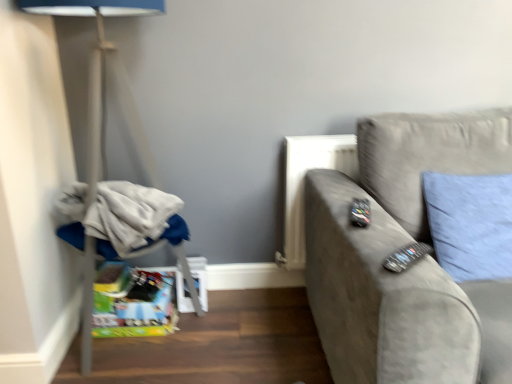
Question: Is black plastic remote at right, which is the 2th remote from bottom to top, beside matte gray lamp at left?

Choices:
 (A) yes
 (B) no

Answer: (B)

Question: Can you confirm if black plastic remote at right, the first remote in the back-to-front sequence, is bigger than matte gray lamp at left?

Choices:
 (A) yes
 (B) no

Answer: (B)

Question: Can you confirm if black plastic remote at right, the first remote in the back-to-front sequence, is smaller than matte gray lamp at left?

Choices:
 (A) no
 (B) yes

Answer: (B)

Question: Considering the relative sizes of black plastic remote at right, the first remote in the back-to-front sequence, and matte gray lamp at left in the image provided, is black plastic remote at right, the first remote in the back-to-front sequence, shorter than matte gray lamp at left?

Choices:
 (A) yes
 (B) no

Answer: (A)

Question: Is black plastic remote at right, acting as the 1th remote starting from the top, positioned far away from matte gray lamp at left?

Choices:
 (A) yes
 (B) no

Answer: (B)

Question: From a real-world perspective, is black plastic remote at right, which is the 2th remote from bottom to top, located higher than matte gray lamp at left?

Choices:
 (A) yes
 (B) no

Answer: (A)

Question: Is black plastic remote at right, acting as the 1th remote starting from the top, at the back of black plastic remote at right, the second remote when ordered from top to bottom?

Choices:
 (A) no
 (B) yes

Answer: (B)

Question: Does black plastic remote at right, which is the 2th remote from back to front, contain black plastic remote at right, which is the 2th remote from bottom to top?

Choices:
 (A) no
 (B) yes

Answer: (A)

Question: Is black plastic remote at right, positioned as the 1th remote in front-to-back order, to the right of black plastic remote at right, which is the 2th remote from bottom to top, from the viewer's perspective?

Choices:
 (A) yes
 (B) no

Answer: (A)

Question: From a real-world perspective, is black plastic remote at right, arranged as the 1th remote when ordered from the bottom, beneath black plastic remote at right, which is the 2th remote from bottom to top?

Choices:
 (A) yes
 (B) no

Answer: (A)

Question: Is black plastic remote at right, the second remote when ordered from top to bottom, oriented towards black plastic remote at right, acting as the 1th remote starting from the top?

Choices:
 (A) no
 (B) yes

Answer: (A)

Question: Is black plastic remote at right, arranged as the 1th remote when ordered from the bottom, far from black plastic remote at right, the first remote in the back-to-front sequence?

Choices:
 (A) no
 (B) yes

Answer: (A)

Question: Is blue fabric pillow at right outside suede gray couch at right?

Choices:
 (A) yes
 (B) no

Answer: (B)